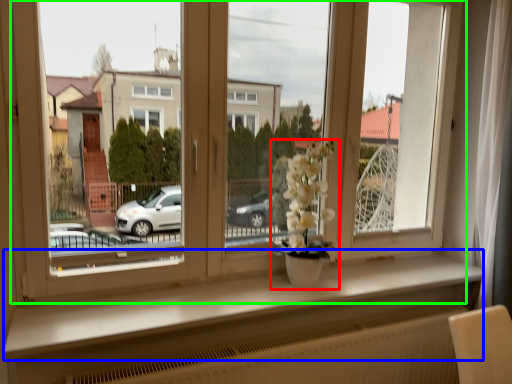
Question: Based on their relative distances, which object is farther from houseplant (highlighted by a red box)? Choose from window sill (highlighted by a blue box) and window (highlighted by a green box).

Choices:
 (A) window sill
 (B) window

Answer: (A)